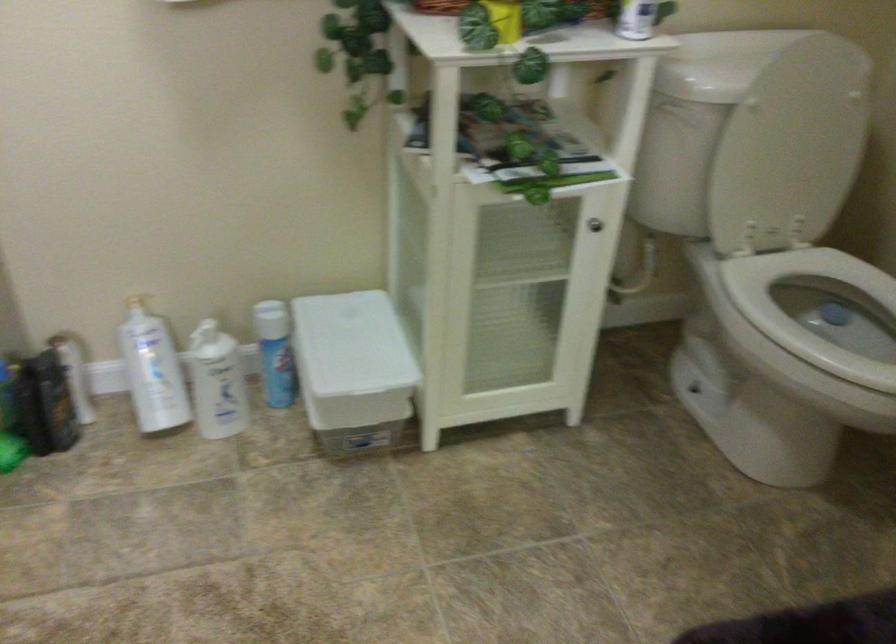
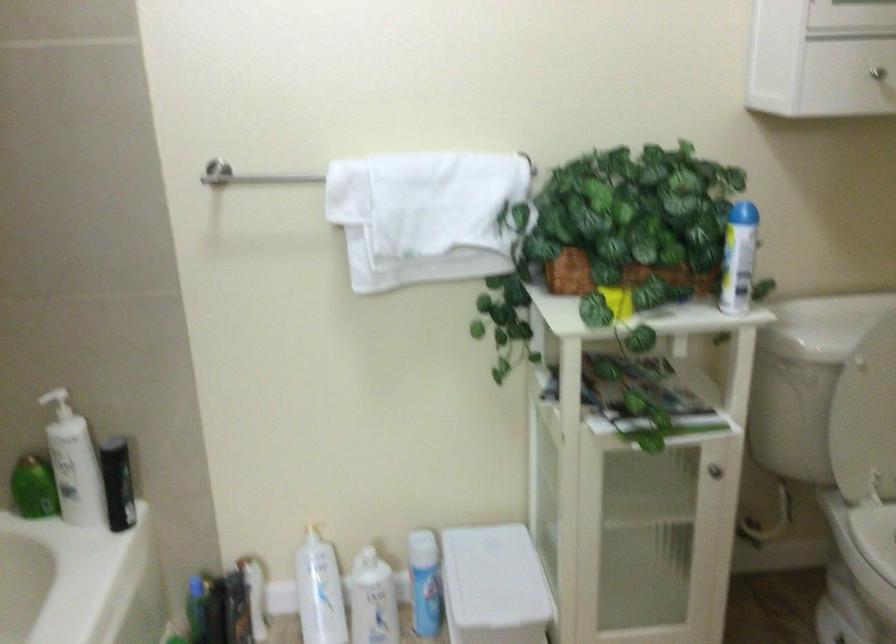
In the second image, find the point that corresponds to (352,348) in the first image.

(493, 580)